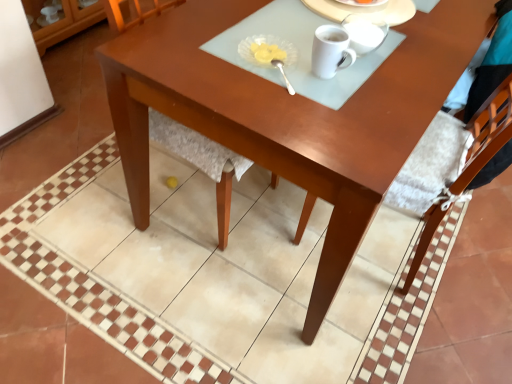
You are a GUI agent. You are given a task and a screenshot of the screen. Output one action in this format:
    pyautogui.click(x=<x>, y=<y>)
    Task: Click on the unoccupied area behind translucent glass dish at upper center, positioned as the third tableware in top-to-bottom order
    
    Given the screenshot: What is the action you would take?
    pyautogui.click(x=270, y=27)